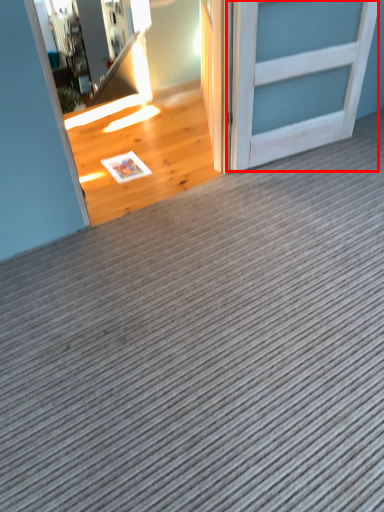
Question: In this image, where is door (annotated by the red box) located relative to door?

Choices:
 (A) left
 (B) right

Answer: (B)